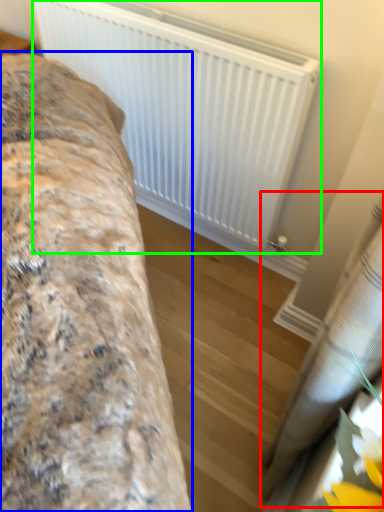
Question: Based on their relative distances, which object is nearer to curtain (highlighted by a red box)? Choose from furniture (highlighted by a blue box) and radiator (highlighted by a green box).

Choices:
 (A) furniture
 (B) radiator

Answer: (A)